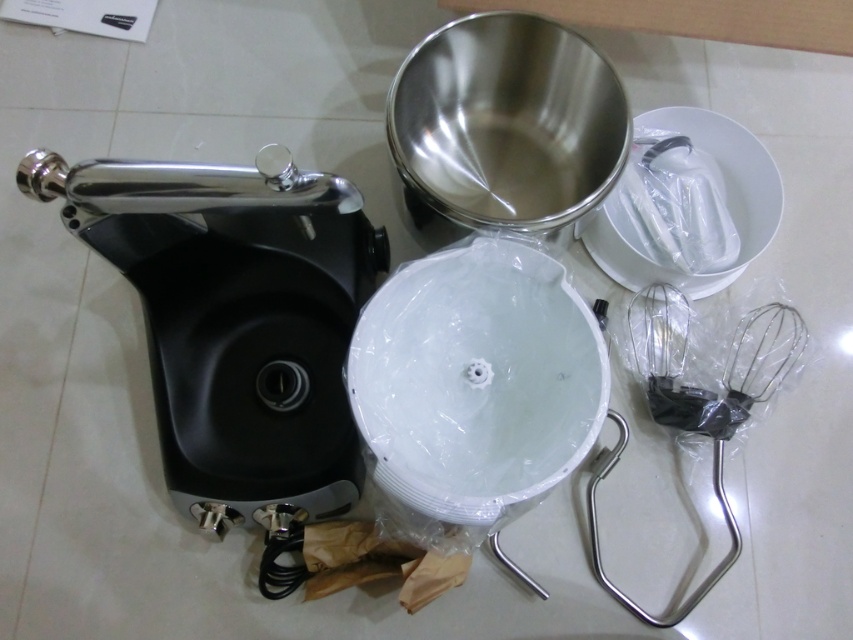
You are organizing the kitchen and need to place a new spice rack between the polished metal stand mixer at left and the stainless steel mixing bowl at upper center. Based on their positions, where should you place the spice rack to ensure it is between them?

The polished metal stand mixer at left is below the stainless steel mixing bowl at upper center, so placing the spice rack between them would require positioning it above the mixer but below the bowl.

Looking at this image, you are standing in a kitchen and want to reach the point at coordinates (323, 182). If your arm can extend 30 inches, will you be able to reach it?

The point at coordinates (323, 182) is 30.69 inches away from the camera, which is slightly beyond your arm reach of 30 inches. Therefore, you will not be able to reach it.